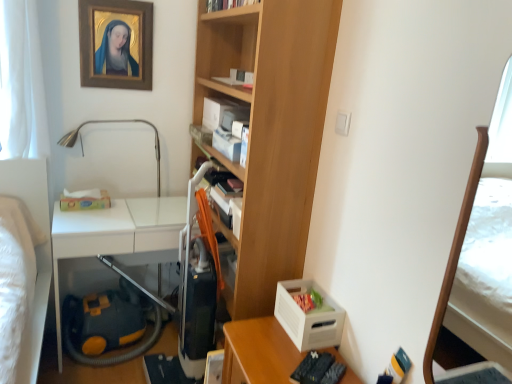
Question: Is wooden desk at lower right smaller than wooden bookcase at center?

Choices:
 (A) yes
 (B) no

Answer: (A)

Question: From a real-world perspective, is wooden desk at lower right below wooden bookcase at center?

Choices:
 (A) yes
 (B) no

Answer: (A)

Question: Is wooden desk at lower right aimed at wooden bookcase at center?

Choices:
 (A) yes
 (B) no

Answer: (B)

Question: Considering the relative positions of wooden desk at lower right and wooden bookcase at center in the image provided, is wooden desk at lower right behind wooden bookcase at center?

Choices:
 (A) no
 (B) yes

Answer: (A)

Question: From a real-world perspective, is wooden desk at lower right located higher than wooden bookcase at center?

Choices:
 (A) yes
 (B) no

Answer: (B)

Question: Looking at their shapes, would you say wooden desk at lower right is wider or thinner than wooden picture frame at upper left?

Choices:
 (A) thin
 (B) wide

Answer: (B)

Question: From a real-world perspective, relative to wooden picture frame at upper left, is wooden desk at lower right vertically above or below?

Choices:
 (A) above
 (B) below

Answer: (B)

Question: Does point (243, 331) appear closer or farther from the camera than point (145, 19)?

Choices:
 (A) farther
 (B) closer

Answer: (B)

Question: Considering the positions of wooden desk at lower right and wooden picture frame at upper left in the image, is wooden desk at lower right taller or shorter than wooden picture frame at upper left?

Choices:
 (A) tall
 (B) short

Answer: (B)

Question: Does point (22, 3) appear closer or farther from the camera than point (102, 38)?

Choices:
 (A) farther
 (B) closer

Answer: (B)

Question: Considering the positions of white sheer curtain at left and wooden picture frame at upper left in the image, is white sheer curtain at left wider or thinner than wooden picture frame at upper left?

Choices:
 (A) wide
 (B) thin

Answer: (A)

Question: Do you think white sheer curtain at left is within wooden picture frame at upper left, or outside of it?

Choices:
 (A) outside
 (B) inside

Answer: (A)

Question: Based on their positions, is white sheer curtain at left located to the left or right of wooden picture frame at upper left?

Choices:
 (A) left
 (B) right

Answer: (A)

Question: From the image's perspective, is wooden bookcase at center located above or below wooden picture frame at upper left?

Choices:
 (A) below
 (B) above

Answer: (A)

Question: Based on their sizes in the image, would you say wooden bookcase at center is bigger or smaller than wooden picture frame at upper left?

Choices:
 (A) big
 (B) small

Answer: (A)